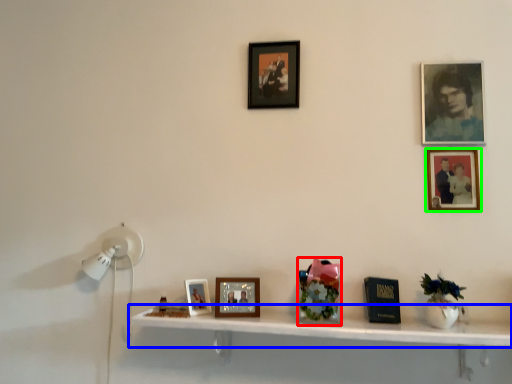
Question: Estimate the real-world distances between objects in this image. Which object is closer to art (highlighted by a red box), shelf (highlighted by a blue box) or picture frame (highlighted by a green box)?

Choices:
 (A) shelf
 (B) picture frame

Answer: (A)